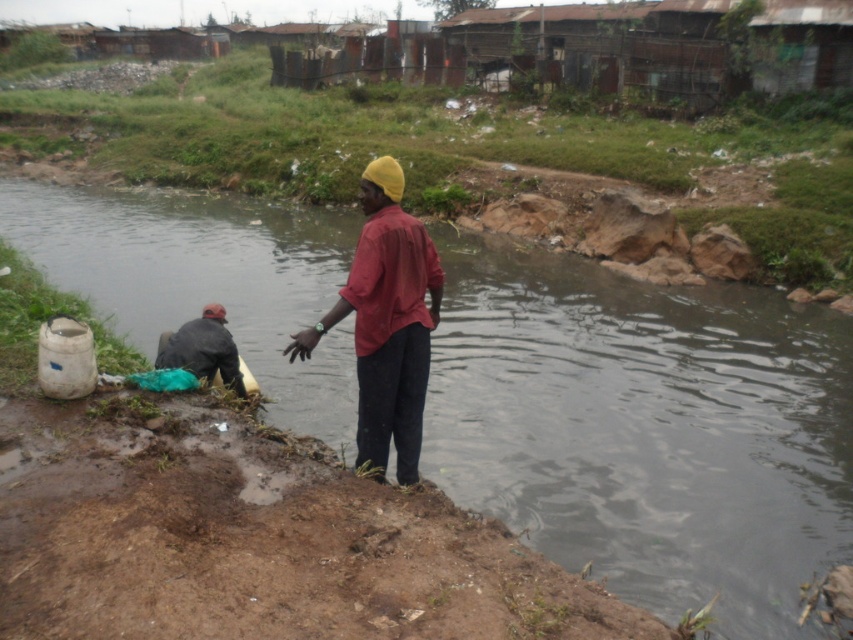
You are a photographer trying to capture both the matte red shirt at center and the dark gray fabric at lower left in a single shot. Based on their positions, which object should you focus on first to ensure both are in clear focus?

The matte red shirt at center is closer to the viewer than the dark gray fabric at lower left. To ensure both are in clear focus, you should focus on the matte red shirt at center first, as it is the closer object.

You are standing at the edge of the scene and want to place a new red umbrella exactly between the brown muddy stream at center and the dark gray fabric at lower left. Based on their positions, which object should the umbrella be closer to?

The brown muddy stream at center is positioned on the right side of dark gray fabric at lower left, so the umbrella placed between them would be closer to the dark gray fabric at lower left since it is on the left side.